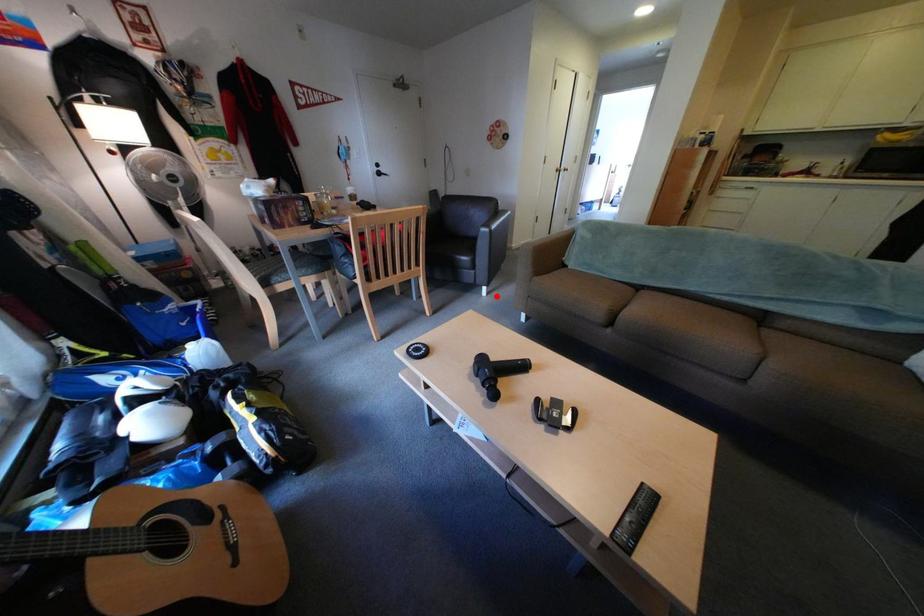
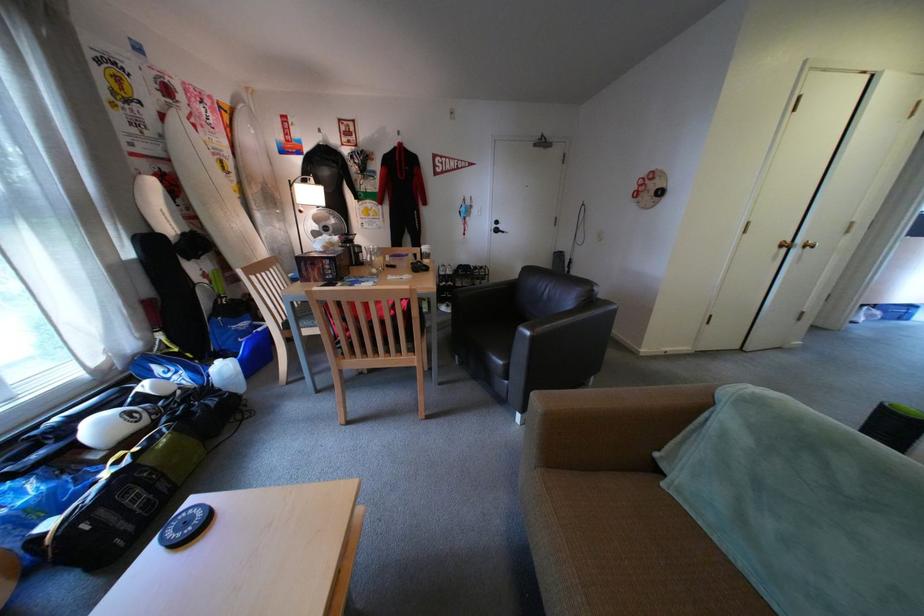
Question: I am providing you with two images of the same scene from different viewpoints. In image1, a red point is highlighted. Considering the same 3D point in image2, which of the following is correct?

Choices:
 (A) It is closer
 (B) It is farther

Answer: (B)